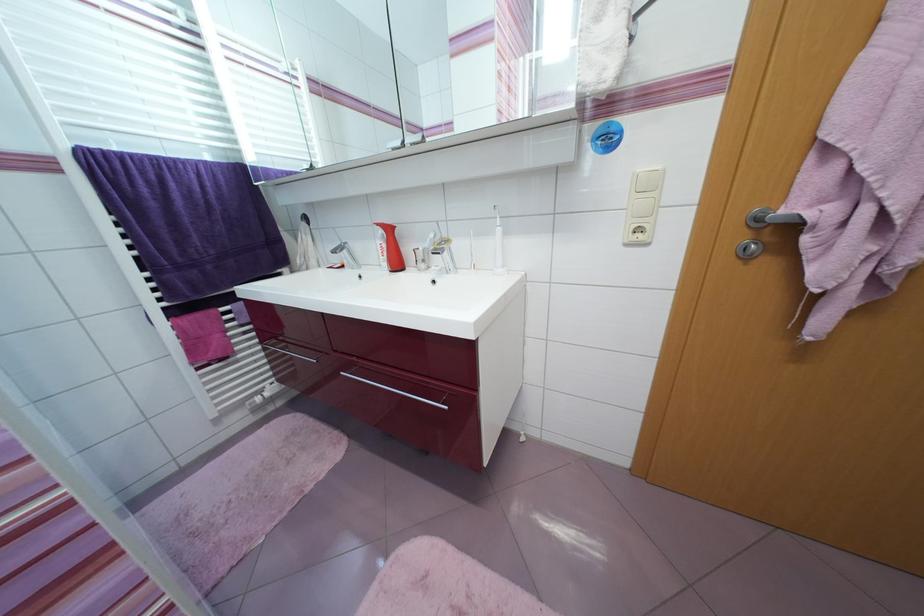
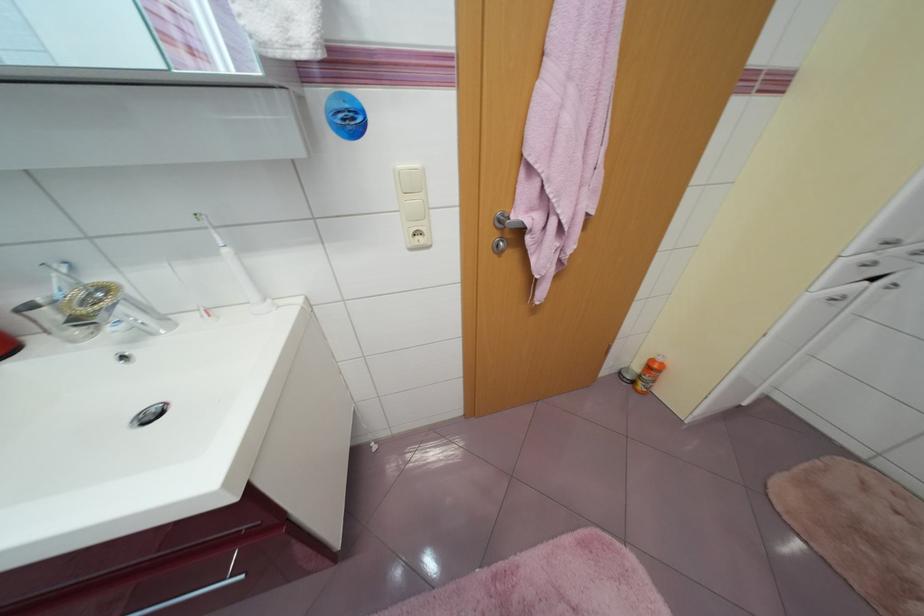
Find the pixel in the second image that matches (508,268) in the first image.

(270, 302)